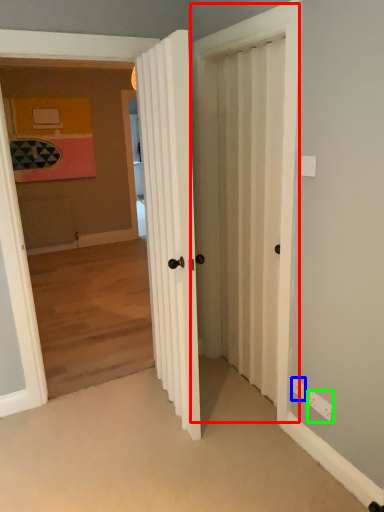
Question: Estimate the real-world distances between objects in this image. Which object is closer to screen door (highlighted by a red box), electric outlet (highlighted by a blue box) or electric outlet (highlighted by a green box)?

Choices:
 (A) electric outlet
 (B) electric outlet

Answer: (B)